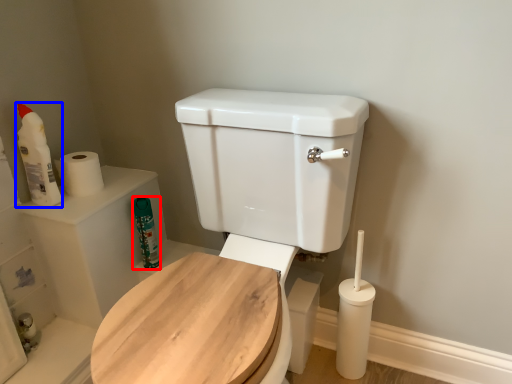
Question: Among these objects, which one is farthest to the camera, cleaning product (highlighted by a red box) or cleaning product (highlighted by a blue box)?

Choices:
 (A) cleaning product
 (B) cleaning product

Answer: (A)